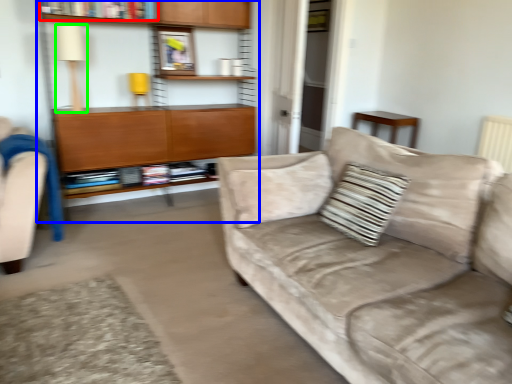
Question: Which object is positioned closest to book (highlighted by a red box)? Select from bookcase (highlighted by a blue box) and lamp (highlighted by a green box).

Choices:
 (A) bookcase
 (B) lamp

Answer: (B)